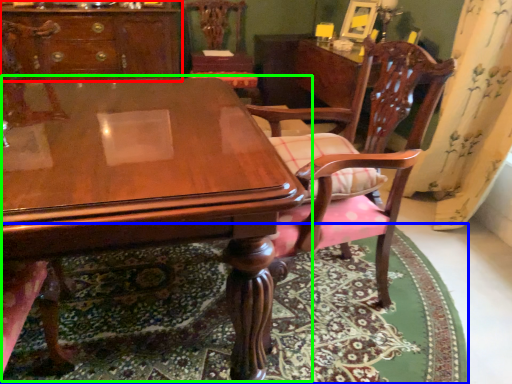
Question: Considering the real-world distances, which object is closest to cabinetry (highlighted by a red box)? mat (highlighted by a blue box) or table (highlighted by a green box).

Choices:
 (A) mat
 (B) table

Answer: (B)